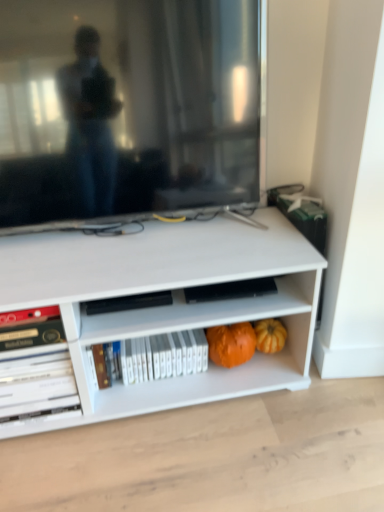
At what (x,y) coordinates should I click in order to perform the action: click on vacant space in front of white glossy book at lower left, marked as the second book in a right-to-left arrangement. Please return your answer as a coordinate pair (x, y). Looking at the image, I should click on (35, 456).